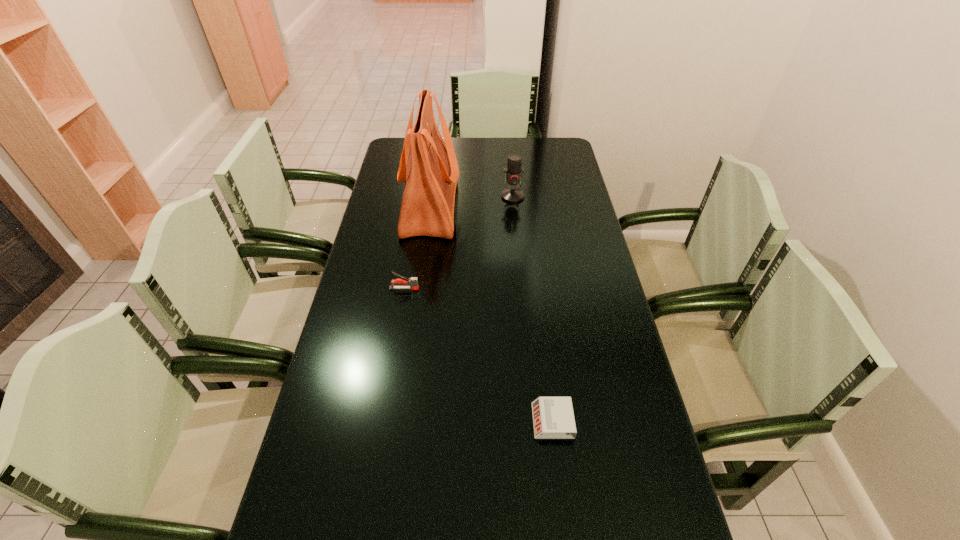
Identify the location of the tallest object. This screenshot has height=540, width=960. (430, 174).

The image size is (960, 540). Find the location of `the third shortest object`. the third shortest object is located at coordinates (513, 171).

I want to click on the second shortest object, so click(413, 281).

Where is `the third farthest object`? the third farthest object is located at coordinates pyautogui.click(x=413, y=281).

Where is `the shortest object`? Image resolution: width=960 pixels, height=540 pixels. the shortest object is located at coordinates pyautogui.click(x=553, y=418).

Where is `alarm clock`? The width and height of the screenshot is (960, 540). alarm clock is located at coordinates click(x=553, y=418).

Where is `free space located on the front pocket of the tallest object`? The width and height of the screenshot is (960, 540). free space located on the front pocket of the tallest object is located at coordinates (551, 207).

Where is `vacant space located on the side of the second tallest object with the red ring`? vacant space located on the side of the second tallest object with the red ring is located at coordinates [x=516, y=223].

Identify the location of free space located on the handle side of the second nearest object. Image resolution: width=960 pixels, height=540 pixels. 448,288.

I want to click on free point located 0.180m on the front of the nearest object, so click(x=565, y=525).